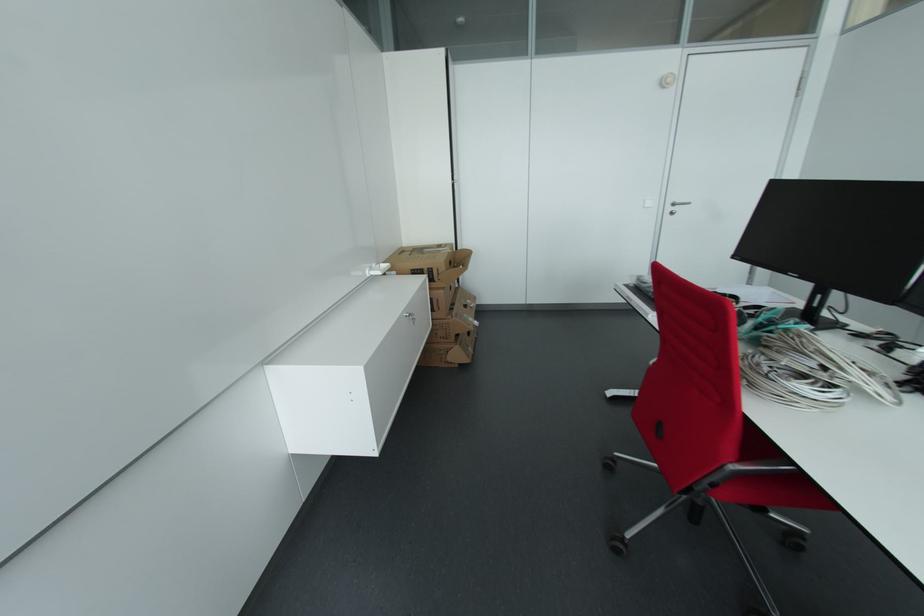
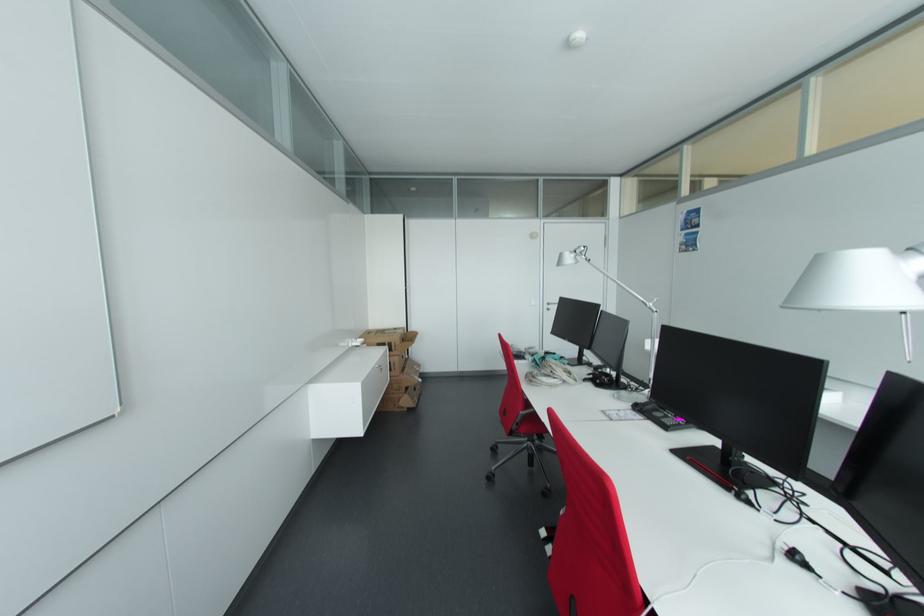
Where in the second image is the point corresponding to [463,249] from the first image?

(412, 331)